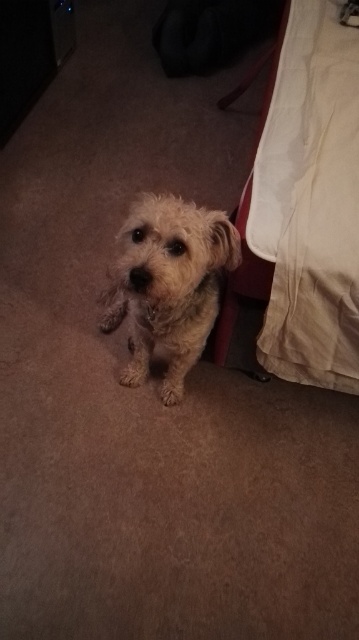
You are a photographer standing in the room where the small dog is sitting. You want to take a photo of the beige fabric bed at right. Where should you position yourself relative to the dog to capture the bed in the frame?

To capture the beige fabric bed at right in the frame, you should position yourself to the right of the dog since the bed is located to the right side of the dog in the image.

You are a pet sitter who needs to ensure the fuzzy fur dog at center has enough space to move around comfortably. Given that the beige fabric bed at right is larger than the dog, can you estimate if the bed is big enough for the dog to lie down on?

The beige fabric bed at right is larger in size than fuzzy fur dog at center, so yes, the bed is big enough for the dog to lie down on comfortably.